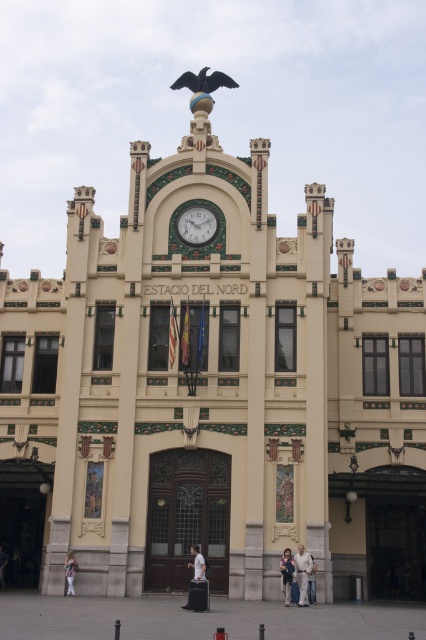
You are standing in front of the grand Art Nouveau building and want to take a photo of the light beige pants at lower left and the white cotton shirt at center. If your camera has a zoom lens that can focus up to 10 meters, will you need to move closer to capture both objects in the same frame?

The light beige pants at lower left is 15.08 meters away from the white cotton shirt at center. Since the maximum focus distance of your camera is 10 meters, you will need to move closer to ensure both objects are within the 10 meter range.

You are standing in front of the grand Art Nouveau building. You notice two elements on the facade. The first is the shiny black eagle at upper center, and the second is the light beige pants at center. Based on their positions, which one is located to the left of the other?

The shiny black eagle at upper center is to the left of the light beige pants at center.